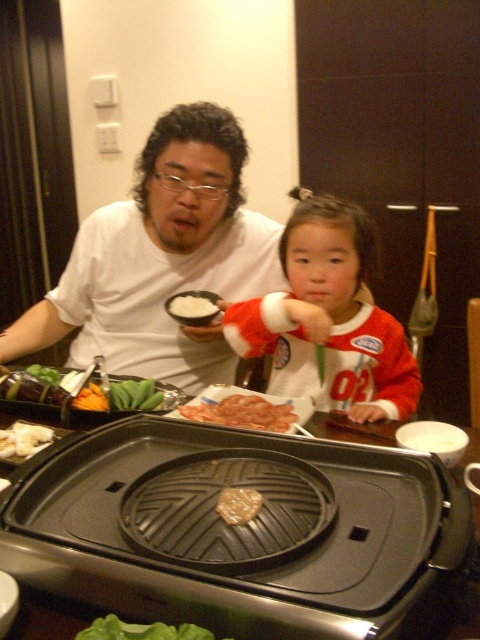
You are a chef preparing a meal and need to place the green leafy vegetables at center on a plate. The plate you have is 1.2 feet in diameter. Will the vegetables fit on the plate?

The green leafy vegetables at center are 3.71 feet apart, which is wider than the plate diameter of 1.2 feet. They will not fit on the plate.